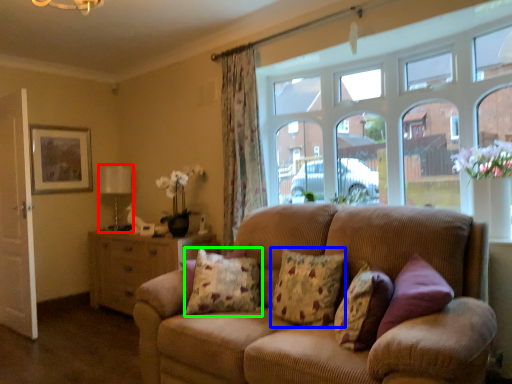
Question: Estimate the real-world distances between objects in this image. Which object is closer to lamp (highlighted by a red box), pillow (highlighted by a blue box) or pillow (highlighted by a green box)?

Choices:
 (A) pillow
 (B) pillow

Answer: (B)